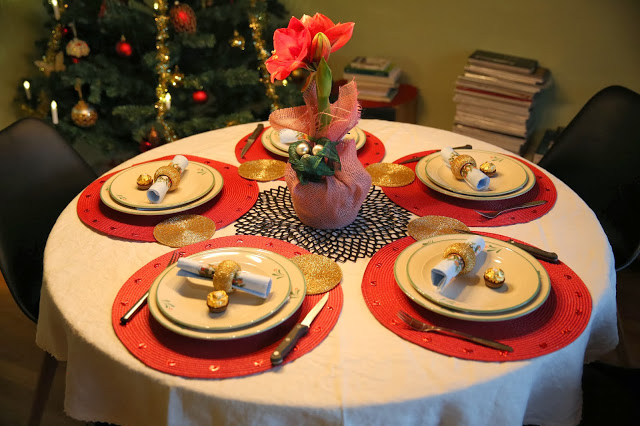
This screenshot has height=426, width=640. I want to click on gold coasters, so click(x=314, y=267), click(x=192, y=226), click(x=269, y=165), click(x=381, y=170), click(x=438, y=224).